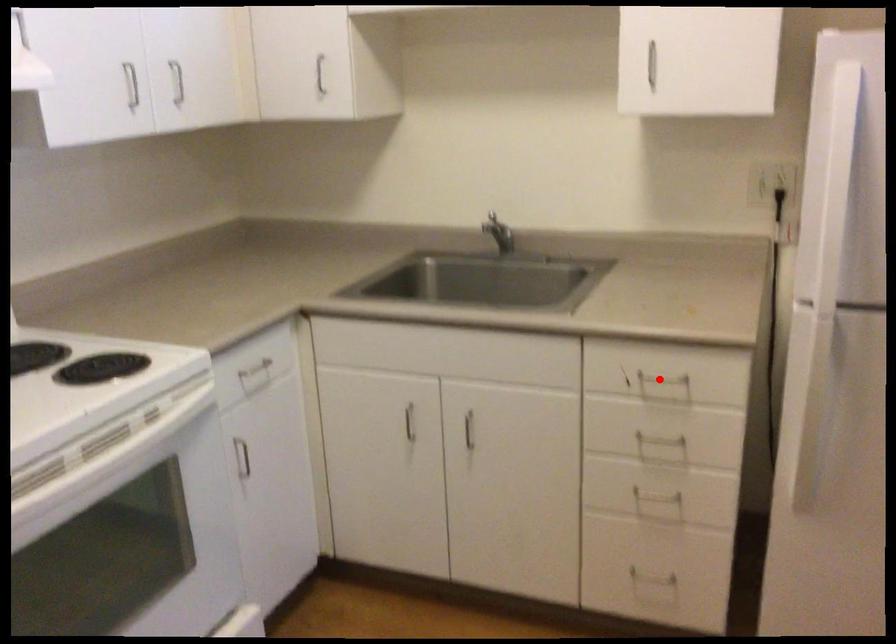
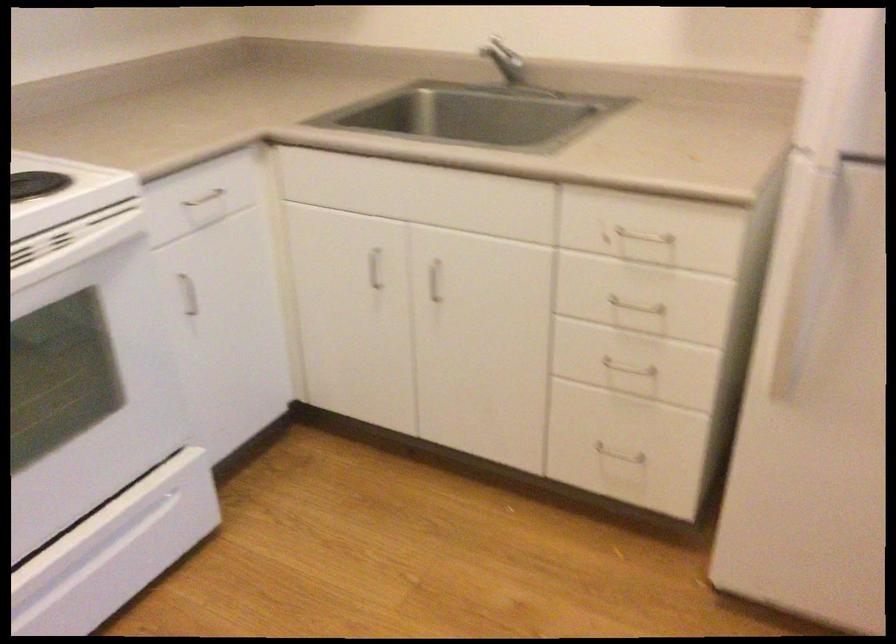
The point at the highlighted location is marked in the first image. Where is the corresponding point in the second image?

(639, 236)